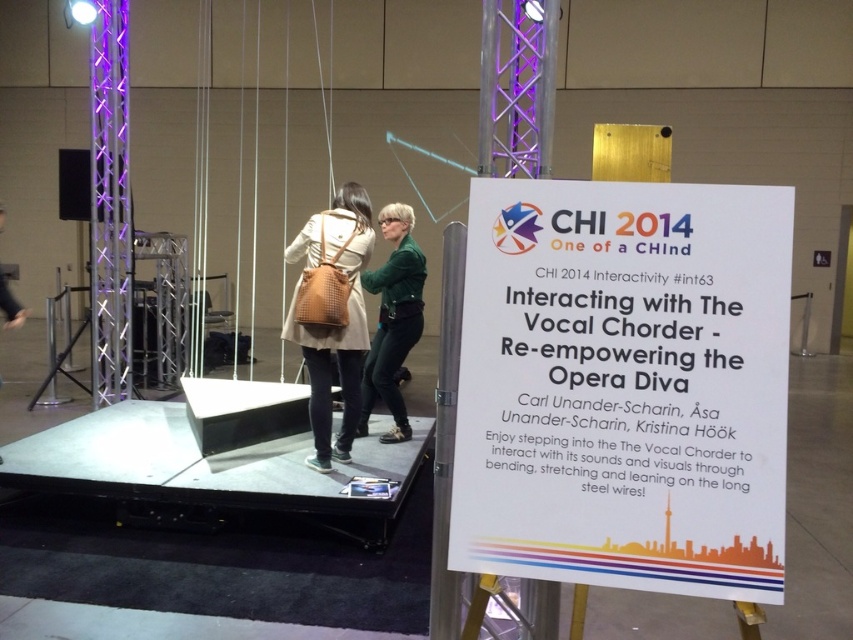
Question: Which object is the closest to the matte brown leather backpack at center?

Choices:
 (A) green matte jacket at center
 (B) white paper sign at center

Answer: (A)

Question: Based on their relative distances, which object is nearer to the green matte jacket at center?

Choices:
 (A) matte brown leather backpack at center
 (B) white paper sign at center

Answer: (A)

Question: Is matte brown leather backpack at center smaller than green matte jacket at center?

Choices:
 (A) yes
 (B) no

Answer: (A)

Question: Is white paper sign at center behind matte brown leather backpack at center?

Choices:
 (A) yes
 (B) no

Answer: (B)

Question: Among these objects, which one is nearest to the camera?

Choices:
 (A) green matte jacket at center
 (B) matte brown leather backpack at center

Answer: (B)

Question: Can you confirm if matte brown leather backpack at center is positioned to the right of green matte jacket at center?

Choices:
 (A) no
 (B) yes

Answer: (A)